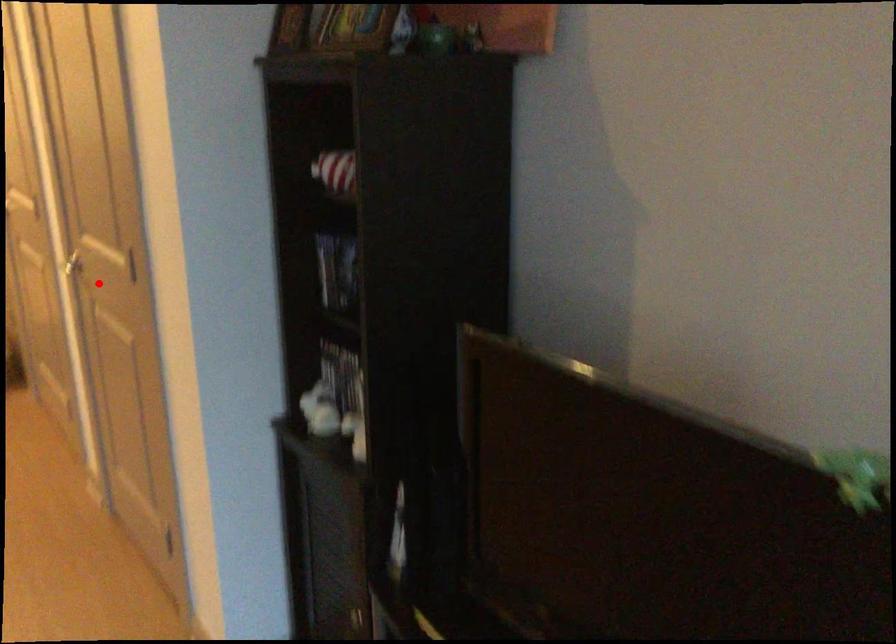
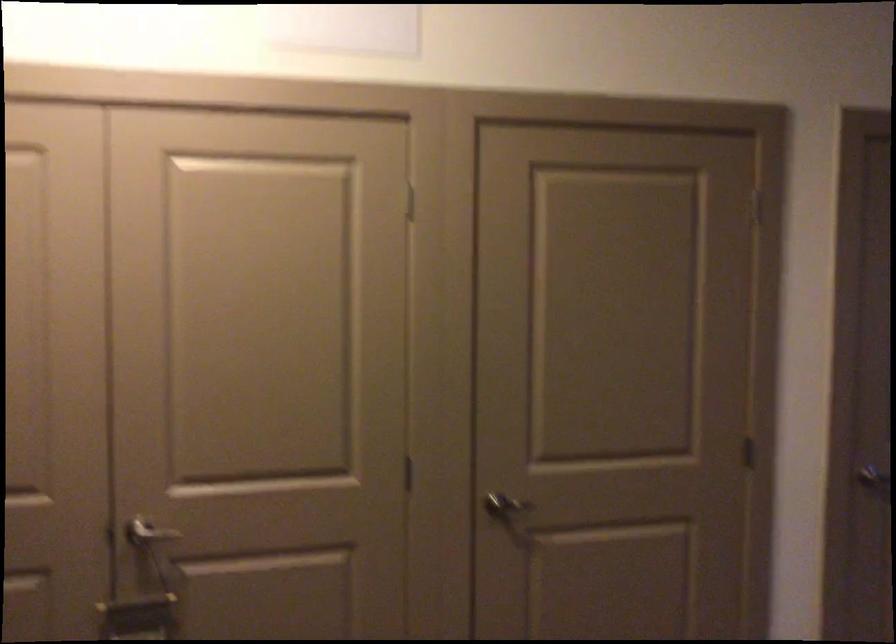
Where in the second image is the point corresponding to the highlighted location from the first image?

(853, 476)